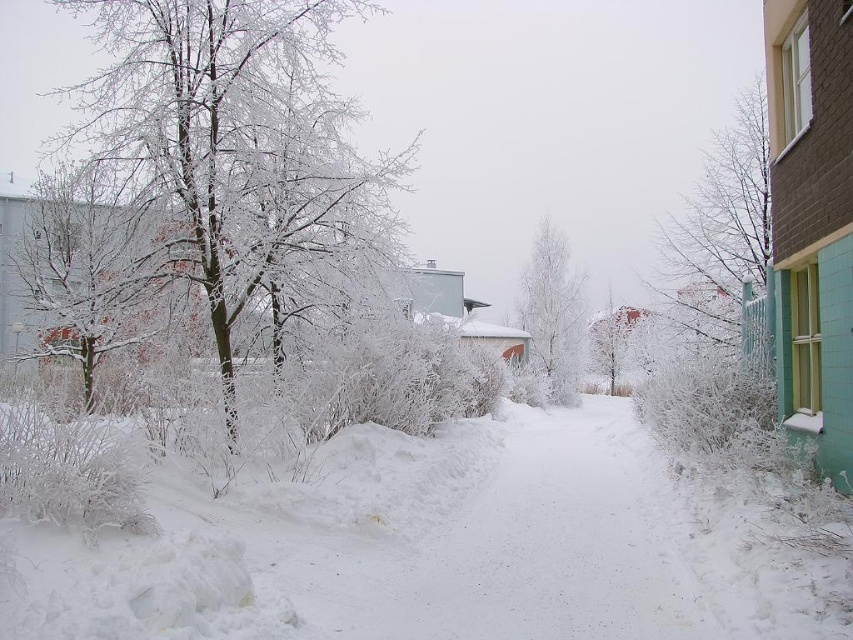
Based on the photo, does white fluffy snow at center appear on the left side of white frosty tree at center?

Indeed, white fluffy snow at center is positioned on the left side of white frosty tree at center.

Which is behind, point (621, 483) or point (572, 371)?

The point (572, 371) is more distant.

Does point (686, 548) come farther from viewer compared to point (584, 333)?

No, (686, 548) is closer to viewer.

Where is `white fluffy snow at center`? Image resolution: width=853 pixels, height=640 pixels. white fluffy snow at center is located at coordinates (437, 547).

How distant is frosty white tree at left from white frosty tree at center?

A distance of 32.76 meters exists between frosty white tree at left and white frosty tree at center.

Is frosty white tree at left bigger than white frosty tree at center?

Correct, frosty white tree at left is larger in size than white frosty tree at center.

What do you see at coordinates (80, 272) in the screenshot?
I see `frosty white tree at left` at bounding box center [80, 272].

The width and height of the screenshot is (853, 640). In order to click on frosty white tree at left in this screenshot , I will do `click(80, 272)`.

Does white fluffy snow at center have a lesser height compared to icy white branches at left?

Indeed, white fluffy snow at center has a lesser height compared to icy white branches at left.

Can you confirm if white fluffy snow at center is bigger than icy white branches at left?

Actually, white fluffy snow at center might be smaller than icy white branches at left.

Is point (447, 557) farther from camera compared to point (209, 214)?

No, (447, 557) is in front of (209, 214).

I want to click on white fluffy snow at center, so click(x=437, y=547).